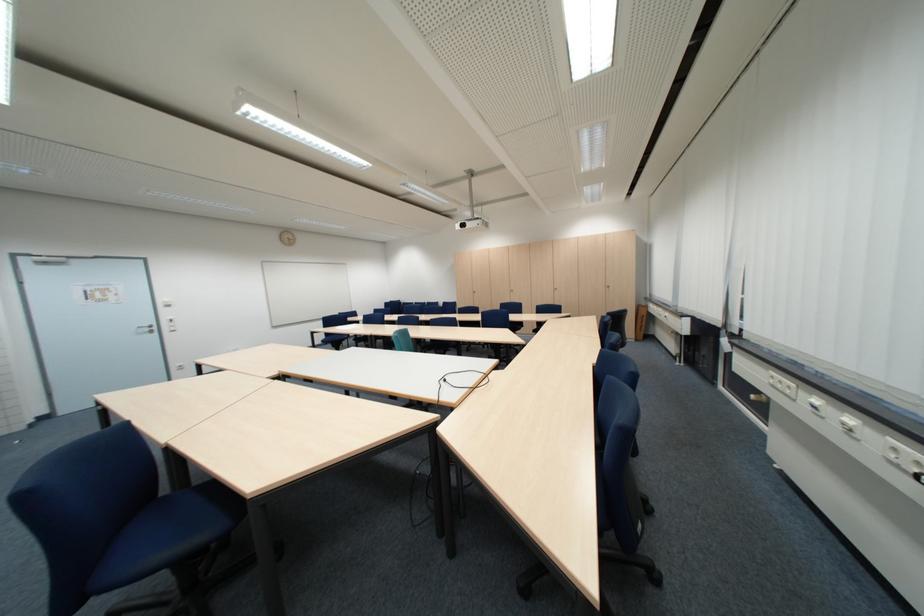
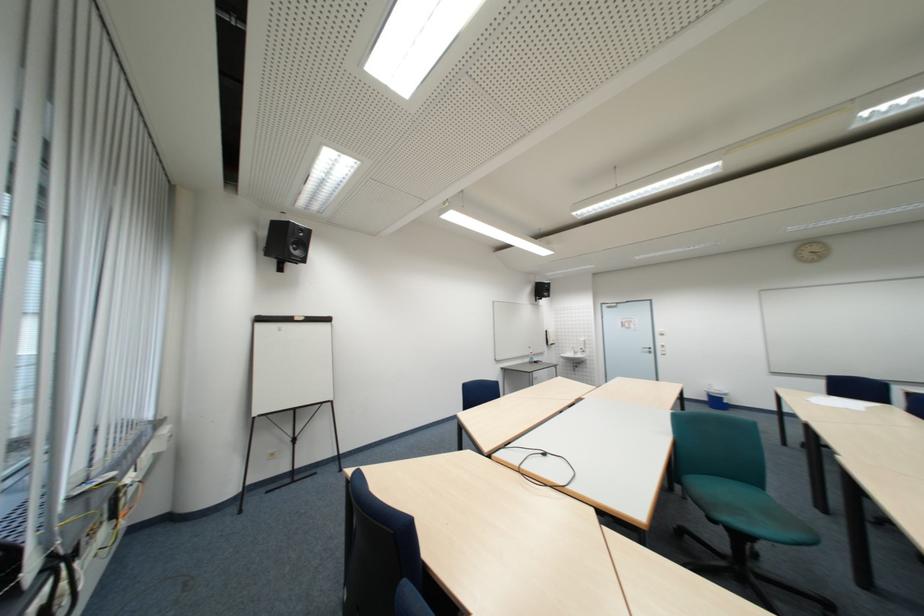
Question: I am providing you with two images of the same scene from different viewpoints. After the viewpoint changes to image2, which objects are now occluded?

Choices:
 (A) blue chair sitting surface
 (B) faucet handle
 (C) black magazine
 (D) blue trash can

Answer: (A)